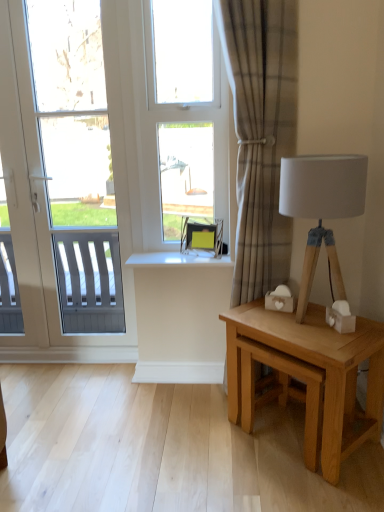
Question: Looking at the image, does white plastic window at left seem bigger or smaller compared to white glossy window sill at center?

Choices:
 (A) big
 (B) small

Answer: (A)

Question: Is point (220, 326) closer or farther from the camera than point (220, 265)?

Choices:
 (A) closer
 (B) farther

Answer: (B)

Question: Which object is the closest to the clear glass window at center?

Choices:
 (A) white glossy window sill at center
 (B) white plastic window at left
 (C) light brown wooden table at right
 (D) wooden tripod lamp at right
 (E) plaid fabric curtain at center

Answer: (E)

Question: Estimate the real-world distances between objects in this image. Which object is closer to the plaid fabric curtain at center?

Choices:
 (A) matte black swivel chair at center
 (B) white glossy window sill at center
 (C) wooden tripod lamp at right
 (D) light brown wooden table at right
 (E) clear glass window at center

Answer: (C)